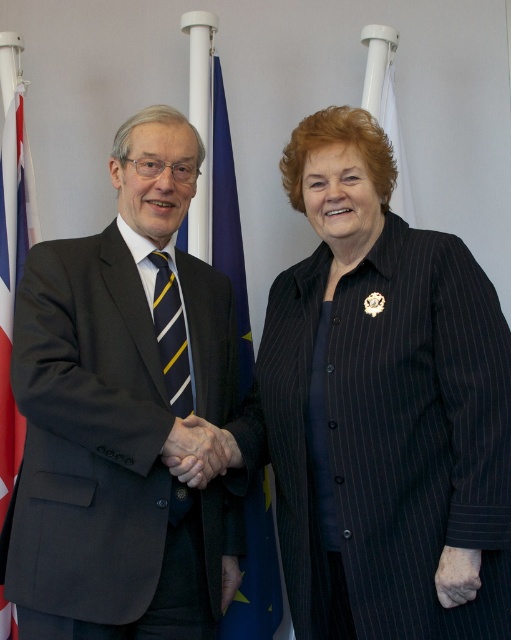
Looking at this image, you are attending a formal event and need to determine the appropriate attire for a photograph. Given the dark gray suit at left and the yellow and blue striped tie at left, which item would be more noticeable in the photo?

The dark gray suit at left is larger in size compared to the yellow and blue striped tie at left, so the dark gray suit at left would be more noticeable in the photo.

You are observing a formal event where two people are shaking hands. The dark gray suit at left is worn by a man, and the smooth skin hand at center belongs to the woman. Based on the description, which object is positioned higher in the image?

The dark gray suit at left is positioned higher than the smooth skin hand at center.

You are an event photographer who needs to capture a closeup shot of the dark gray suit at left and the smooth skin hand at center. Given their sizes, which object should you focus on first to ensure both are in frame without moving the camera?

The dark gray suit at left is larger than the smooth skin hand at center, so you should focus on the dark gray suit at left first to ensure it fits in the frame before adjusting for the smaller hand.